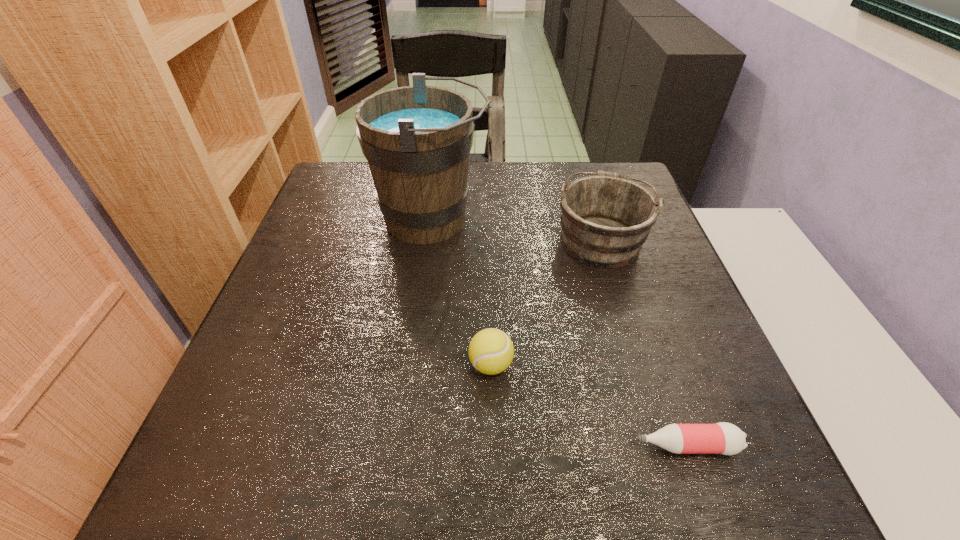
The height and width of the screenshot is (540, 960). Identify the location of the taller wine bucket. (417, 139).

Identify the location of the tallest object. The height and width of the screenshot is (540, 960). (417, 139).

Locate an element on the screen. the second tallest object is located at coordinates (605, 219).

You are a GUI agent. You are given a task and a screenshot of the screen. Output one action in this format:
    pyautogui.click(x=<x>, y=<y>)
    Task: Click on the right wine bucket
    This screenshot has height=540, width=960.
    Given the screenshot: What is the action you would take?
    pyautogui.click(x=605, y=219)

Locate an element on the screen. This screenshot has height=540, width=960. the second shortest object is located at coordinates (491, 351).

Image resolution: width=960 pixels, height=540 pixels. Identify the location of tennis ball. (491, 351).

What are the coordinates of `bottle` in the screenshot? It's located at (724, 438).

This screenshot has width=960, height=540. Identify the location of the shortest object. (724, 438).

The height and width of the screenshot is (540, 960). Find the location of `vacant space located with a handle on the side of the tallest object`. vacant space located with a handle on the side of the tallest object is located at coordinates (608, 219).

Identify the location of free space located on the front of the third shortest object. Image resolution: width=960 pixels, height=540 pixels. (632, 340).